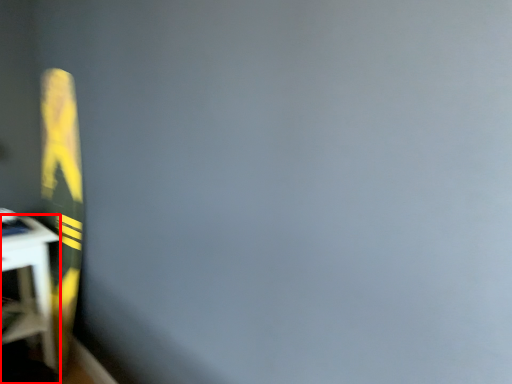
Question: From the image's perspective, where is furniture (annotated by the red box) located relative to bulletin board?

Choices:
 (A) below
 (B) above

Answer: (A)